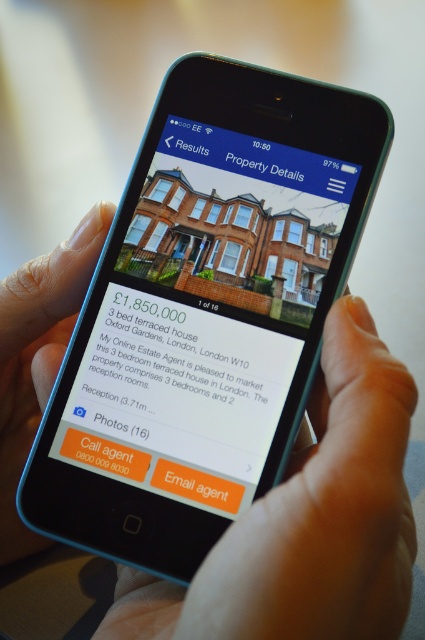
I want to click on smooth skin hand at lower right, so click(308, 520).

Can you confirm if smooth skin hand at lower right is taller than blue glossy property details at upper center?

Correct, smooth skin hand at lower right is much taller as blue glossy property details at upper center.

Is point (380, 616) more distant than point (246, 168)?

No, (380, 616) is in front of (246, 168).

At what (x,y) coordinates should I click in order to perform the action: click on smooth skin hand at lower right. Please return your answer as a coordinate pair (x, y). The height and width of the screenshot is (640, 425). Looking at the image, I should click on (308, 520).

How far apart are smooth skin hand at lower right and nail polish at lower left?

smooth skin hand at lower right and nail polish at lower left are 8.48 inches apart.

Can you confirm if smooth skin hand at lower right is positioned to the left of nail polish at lower left?

In fact, smooth skin hand at lower right is to the right of nail polish at lower left.

Between point (314, 528) and point (13, 552), which one is positioned behind?

The point (13, 552) is behind.

Identify the location of smooth skin hand at lower right. (308, 520).

Find the location of a particular element. nail polish at lower left is located at coordinates (37, 355).

Is point (62, 285) in front of point (289, 168)?

No, it is behind (289, 168).

Which is behind, point (96, 252) or point (272, 164)?

The point (96, 252) is more distant.

Where is `nail polish at lower left`? nail polish at lower left is located at coordinates (37, 355).